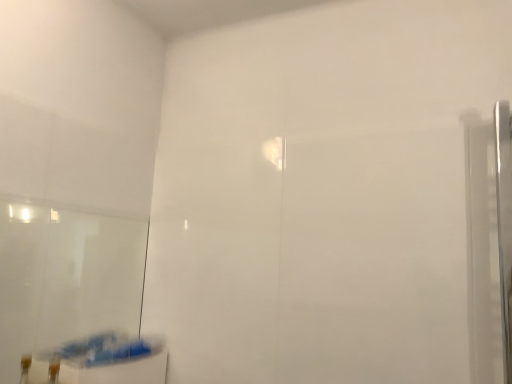
Find the location of a particular element. blue plastic toothbrush at lower left is located at coordinates (99, 361).

What do you see at coordinates (99, 361) in the screenshot? I see `blue plastic toothbrush at lower left` at bounding box center [99, 361].

This screenshot has width=512, height=384. Identify the location of blue plastic toothbrush at lower left. (99, 361).